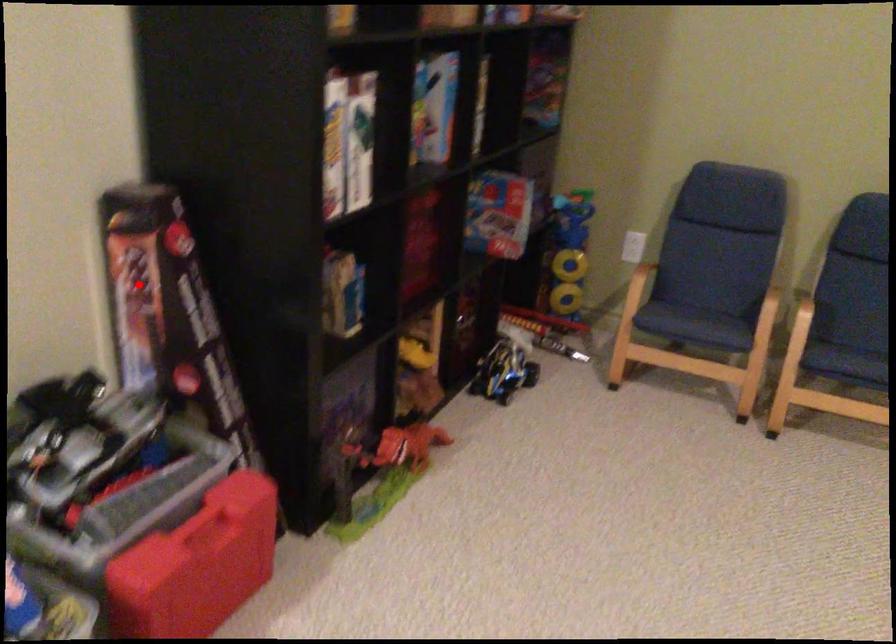
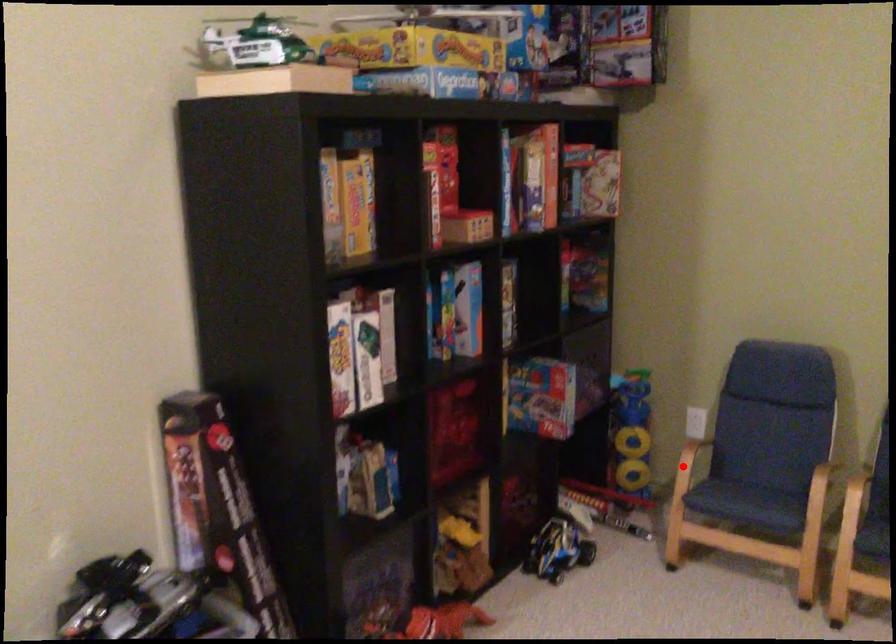
I am providing you with two images of the same scene from different viewpoints. A red point is marked on the first image and another point is marked on the second image. Do the highlighted points in image1 and image2 indicate the same real-world spot?

No